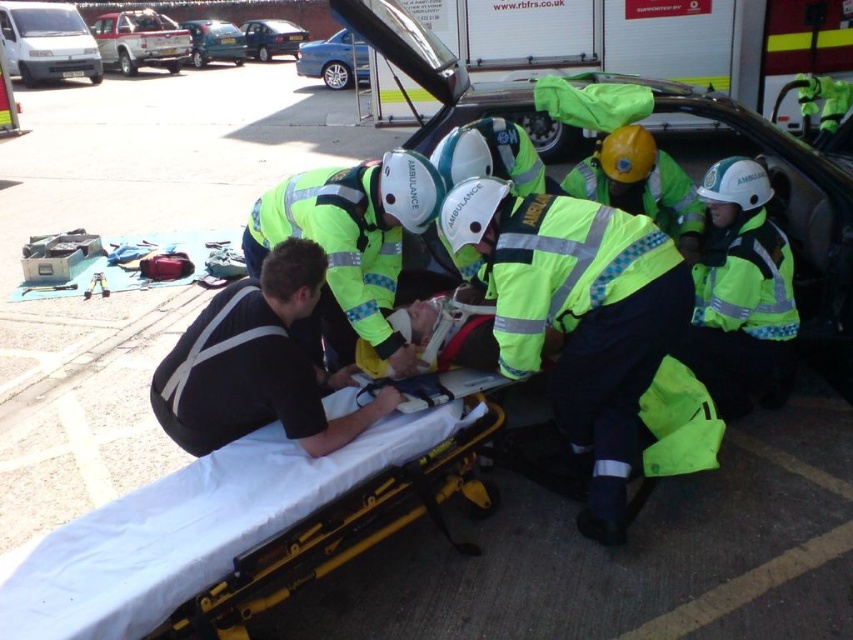
Question: Estimate the real-world distances between objects in this image. Which object is closer to the high-visibility yellow jacket at center?

Choices:
 (A) metallic silver sedan at upper left
 (B) metallic blue car at upper left
 (C) bright yellow reflective jacket at center-right

Answer: (C)

Question: Can you confirm if black fabric shirt at lower left is thinner than high-visibility yellow jacket at center?

Choices:
 (A) no
 (B) yes

Answer: (B)

Question: Is high-visibility yellow jacket at center behind blue metallic sedan at upper center?

Choices:
 (A) no
 (B) yes

Answer: (A)

Question: Which point is farther to the camera?

Choices:
 (A) bright yellow reflective jacket at center-right
 (B) high-visibility yellow jacket at center

Answer: (A)

Question: Does silver metallic pickup truck at upper left lie in front of metallic blue car at upper left?

Choices:
 (A) yes
 (B) no

Answer: (A)

Question: Based on their relative distances, which object is farther from the bright yellow reflective jacket at center-right?

Choices:
 (A) silver metallic pickup truck at upper left
 (B) black fabric shirt at lower left
 (C) blue metallic sedan at upper center

Answer: (A)